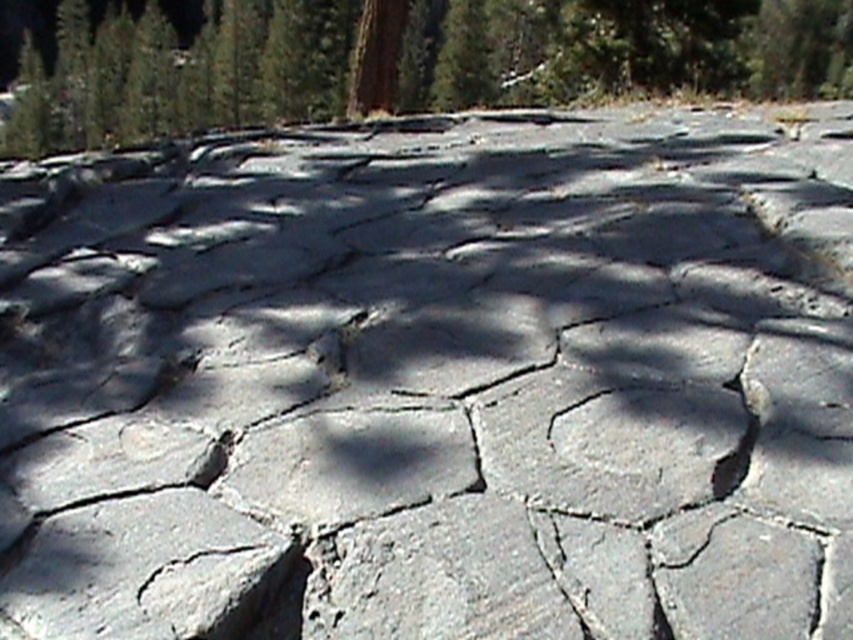
You are a hiker trying to navigate through the forest. You see a green textured tree at center and a gray rough stone at lower left. Which object is higher up in the image?

The green textured tree at center is located above the gray rough stone at lower left, so it is higher up in the image.

You are a hiker trying to navigate through the forest. You see the green textured tree at center and the gray rough stone at lower left. Which object is taller and can help you determine your position?

The green textured tree at center is much taller than the gray rough stone at lower left, so it can help you determine your position better.

You are a gardener trying to plant a new shrub between the green textured tree at center and the gray rough stone at lower left. Based on their widths, which object should you place the shrub closer to to ensure it has enough space?

The green textured tree at center might be wider than gray rough stone at lower left, so you should place the shrub closer to the gray rough stone at lower left to ensure it has enough space.